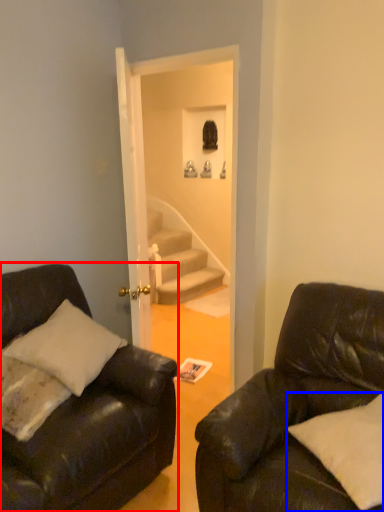
Question: Which of the following is the farthest to the observer, studio couch (highlighted by a red box) or pillow (highlighted by a blue box)?

Choices:
 (A) studio couch
 (B) pillow

Answer: (B)